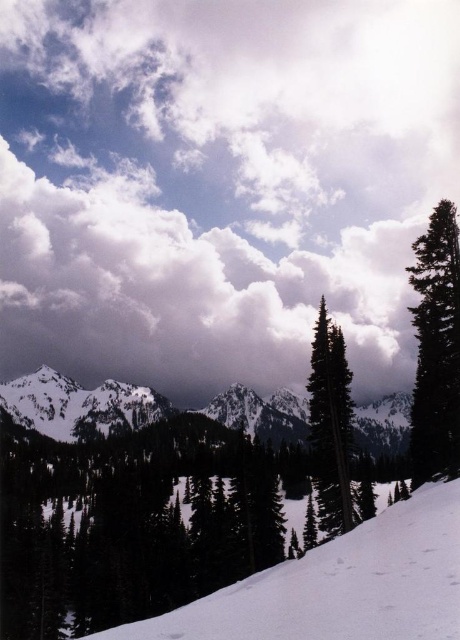
Between white fluffy cloud at upper center and white snow at lower left, which one is positioned lower?

Positioned lower is white snow at lower left.

Which is behind, point (351, 272) or point (377, 627)?

The point (351, 272) is behind.

Find the location of a particular element. This screenshot has width=460, height=640. white fluffy cloud at upper center is located at coordinates point(218,186).

Between white fluffy cloud at upper center and green matte tree at center, which one appears on the left side from the viewer's perspective?

From the viewer's perspective, green matte tree at center appears more on the left side.

Between white fluffy cloud at upper center and green matte tree at center, which one has less height?

With less height is green matte tree at center.

Where is `white fluffy cloud at upper center`? white fluffy cloud at upper center is located at coordinates (218, 186).

Who is more forward, (385, 544) or (327, 483)?

Positioned in front is point (385, 544).

Is white snow at lower left wider than green matte tree at center?

Yes.

Between point (235, 612) and point (325, 348), which one is positioned in front?

Point (235, 612) is more forward.

The image size is (460, 640). Identify the location of white snow at lower left. (340, 586).